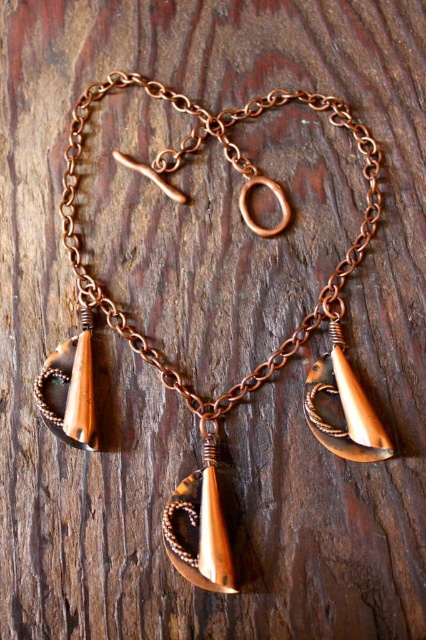
Does copper wire wrapped pendant at center appear on the right side of matte copper pendant at lower right?

No, copper wire wrapped pendant at center is not to the right of matte copper pendant at lower right.

Does point (321, 358) come behind point (376, 433)?

That is True.

Locate an element on the screen. The width and height of the screenshot is (426, 640). copper wire wrapped pendant at center is located at coordinates click(258, 365).